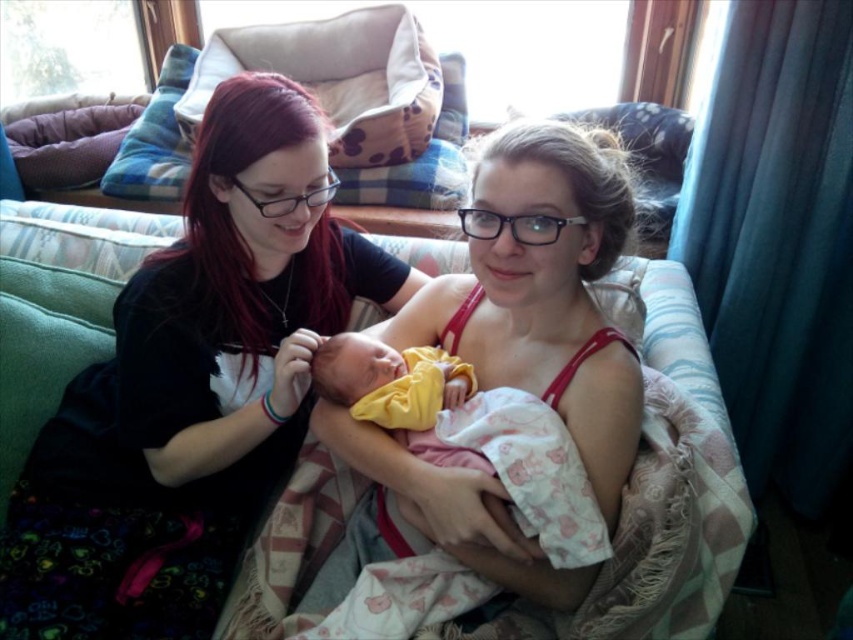
You are a photographer taking a picture of the two women and the baby in the living room. You need to ensure both the pink fabric baby at center and the yellow fabric newborn at center are clearly visible in the frame. Given their current positions, can you fit both into the photo without moving them?

The pink fabric baby at center and the yellow fabric newborn at center are 3.79 inches apart, so yes, both can be captured in the photo as they are close enough to fit within the frame without needing to move them.